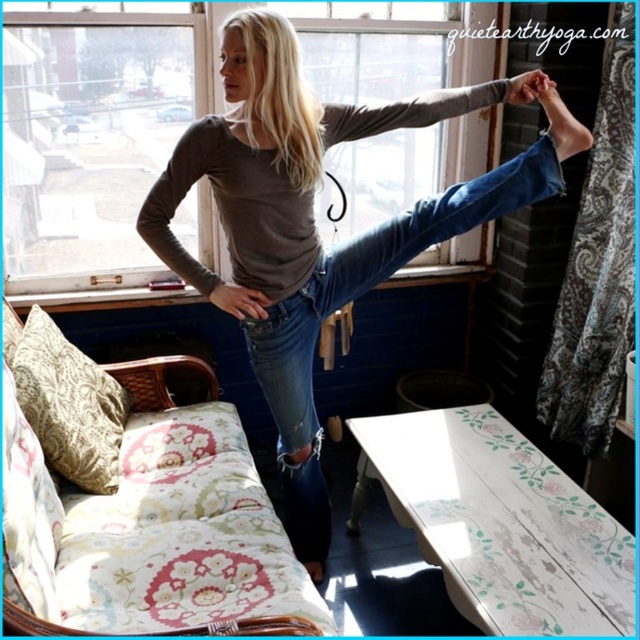
Does point (16, 221) lie behind point (477, 189)?

Yes, point (16, 221) is behind point (477, 189).

Is point (19, 140) less distant than point (355, 132)?

No, (19, 140) is behind (355, 132).

At what (x,y) coordinates should I click in order to perform the action: click on transparent glass window at upper center. Please return your answer as a coordinate pair (x, y). This screenshot has width=640, height=640. Looking at the image, I should click on (93, 141).

Who is more distant from viewer, (477, 188) or (387, 467)?

The point (387, 467) is more distant.

Locate an element on the screen. This screenshot has height=640, width=640. denim jeans at center is located at coordinates pyautogui.click(x=314, y=225).

Can you confirm if white painted wood table at lower right is positioned below matte gray long-sleeve shirt at upper center?

Indeed, white painted wood table at lower right is positioned under matte gray long-sleeve shirt at upper center.

Is white painted wood table at lower right in front of matte gray long-sleeve shirt at upper center?

Yes, white painted wood table at lower right is closer to the viewer.

Does point (460, 472) come farther from viewer compared to point (177, 145)?

Yes, point (460, 472) is behind point (177, 145).

The height and width of the screenshot is (640, 640). I want to click on white painted wood table at lower right, so click(502, 524).